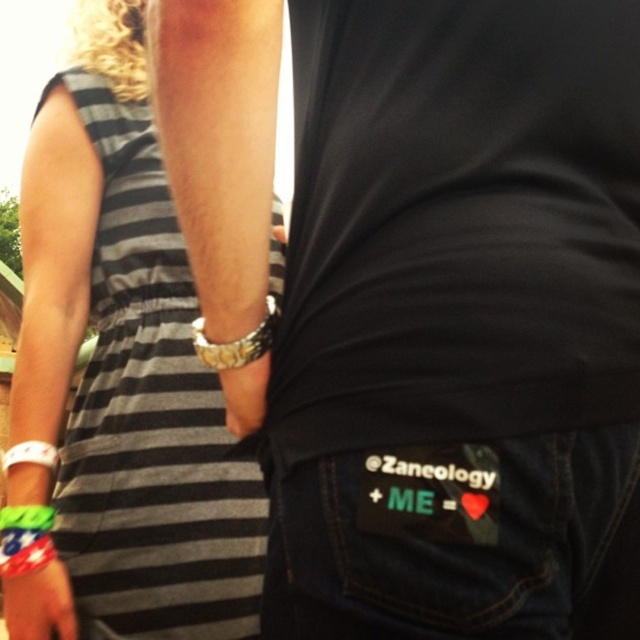
Question: Which point is farther from the camera taking this photo?

Choices:
 (A) click(230, 400)
 (B) click(35, 625)

Answer: (B)

Question: Can you confirm if rubber wristband at lower left is positioned to the left of white rubber bracelet at lower left?

Choices:
 (A) yes
 (B) no

Answer: (B)

Question: Is black striped dress at left positioned at the back of white rubber bracelet at lower left?

Choices:
 (A) no
 (B) yes

Answer: (A)

Question: Which object is farther from the camera taking this photo?

Choices:
 (A) white rubber bracelet at lower left
 (B) black striped dress at left
 (C) gold metallic watch at upper center
 (D) metallic bracelet at upper center

Answer: (A)

Question: Does dark blue denim jeans at center lie behind rubber wristband at lower left?

Choices:
 (A) yes
 (B) no

Answer: (B)

Question: Estimate the real-world distances between objects in this image. Which object is farther from the dark blue denim jeans at center?

Choices:
 (A) rubber wristband at lower left
 (B) metallic bracelet at upper center
 (C) gold metallic watch at upper center
 (D) white rubber bracelet at lower left

Answer: (D)